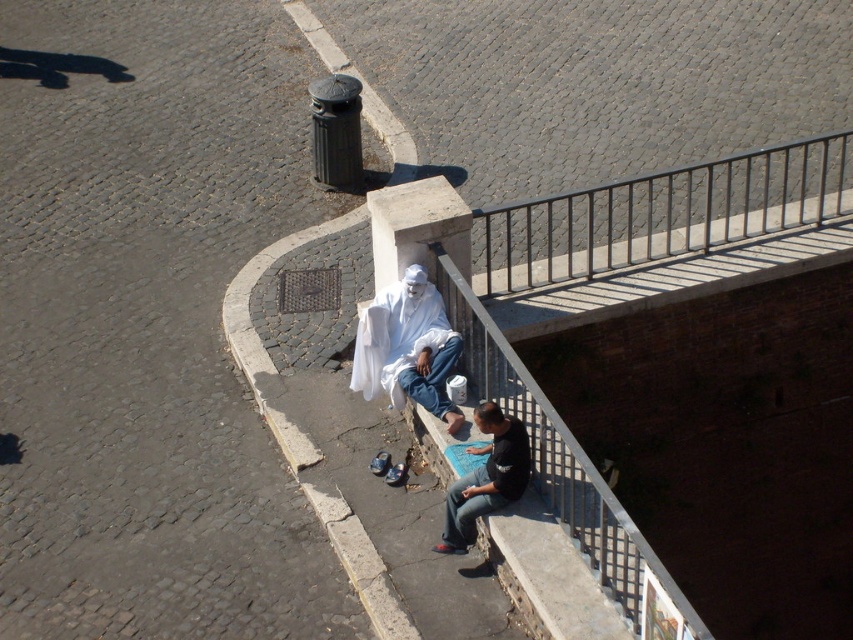
Question: Which point appears closest to the camera in this image?

Choices:
 (A) (811, 224)
 (B) (376, 376)

Answer: (B)

Question: Is white cloth at center to the left of black cotton shirt at lower center from the viewer's perspective?

Choices:
 (A) yes
 (B) no

Answer: (A)

Question: Which point is closer to the camera taking this photo?

Choices:
 (A) (479, 509)
 (B) (428, 300)

Answer: (A)

Question: Which point is closer to the camera taking this photo?

Choices:
 (A) (387, 300)
 (B) (512, 422)
 (C) (851, 188)

Answer: (B)

Question: Can you confirm if white cloth at center is bigger than black cotton shirt at lower center?

Choices:
 (A) yes
 (B) no

Answer: (A)

Question: Does metallic silver rail at upper right have a smaller size compared to black cotton shirt at lower center?

Choices:
 (A) yes
 (B) no

Answer: (B)